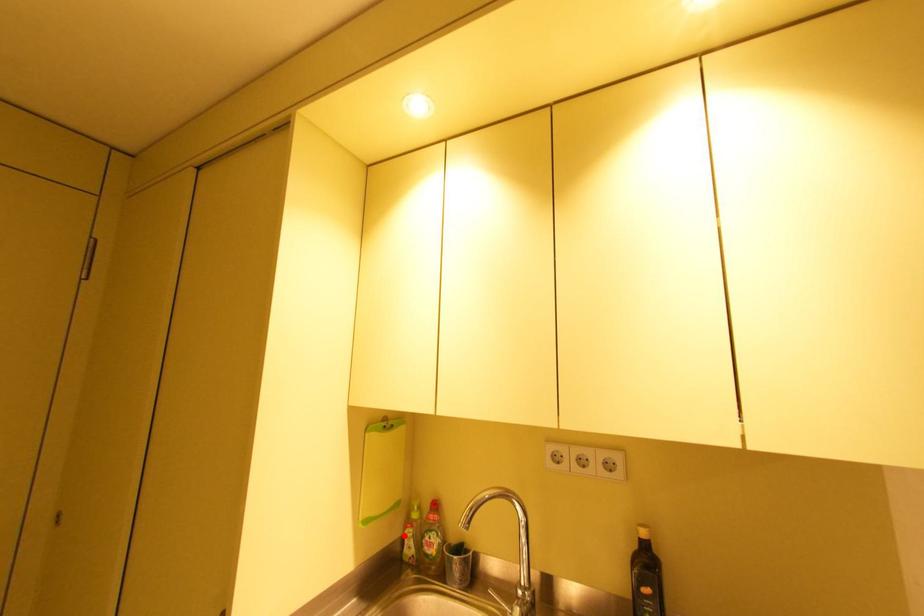
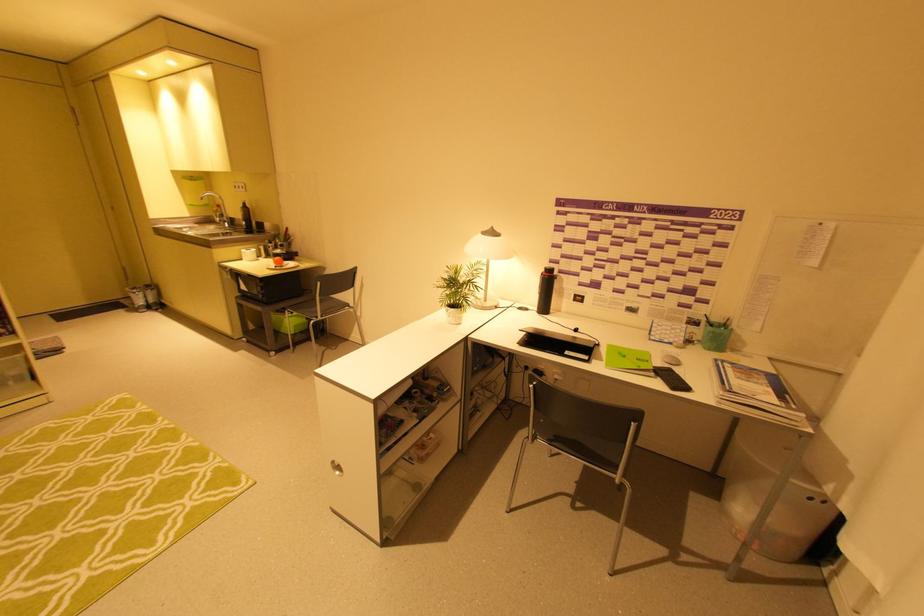
Locate, in the second image, the point that corresponds to the highlighted location in the first image.

(215, 215)